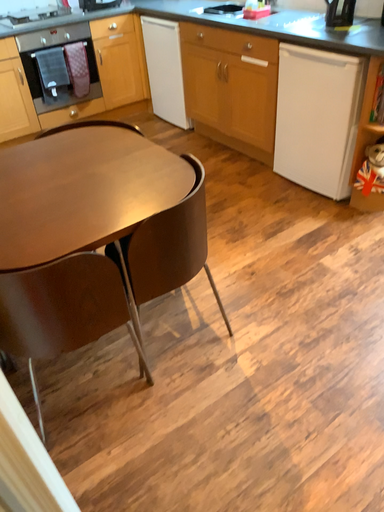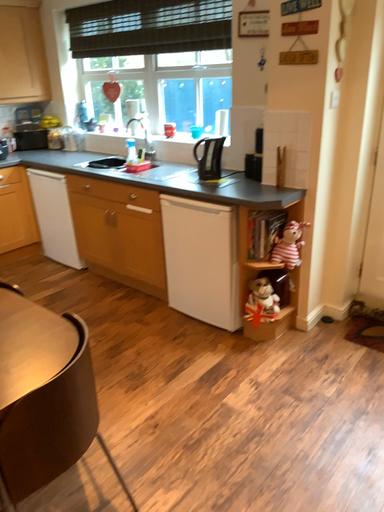
Question: Which way did the camera rotate in the video?

Choices:
 (A) rotated downward
 (B) rotated upward

Answer: (B)